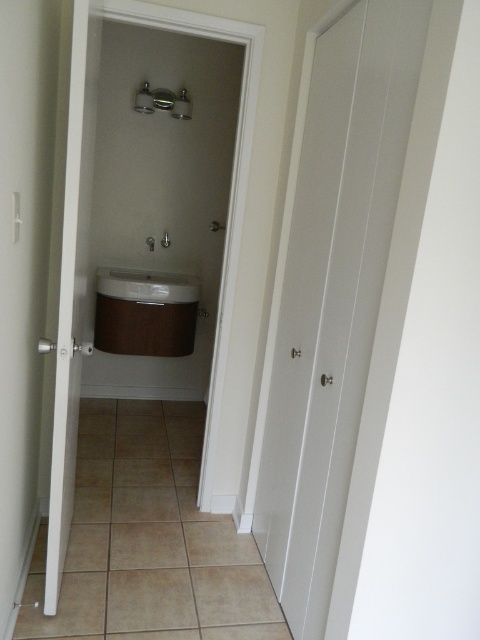
Question: Which object is the farthest from the wooden sink at center?

Choices:
 (A) metallic silver shower at upper center
 (B) white glossy sink at center

Answer: (A)

Question: Among these points, which one is nearest to the camera?

Choices:
 (A) (96, 282)
 (B) (191, 106)

Answer: (B)

Question: Estimate the real-world distances between objects in this image. Which object is farther from the wooden sink at center?

Choices:
 (A) white glossy sink at center
 (B) metallic silver shower at upper center

Answer: (B)

Question: Does white glossy sink at center appear on the left side of metallic silver shower at upper center?

Choices:
 (A) no
 (B) yes

Answer: (B)

Question: Does wooden sink at center appear on the left side of white glossy sink at center?

Choices:
 (A) yes
 (B) no

Answer: (A)

Question: Is wooden sink at center thinner than metallic silver shower at upper center?

Choices:
 (A) no
 (B) yes

Answer: (A)